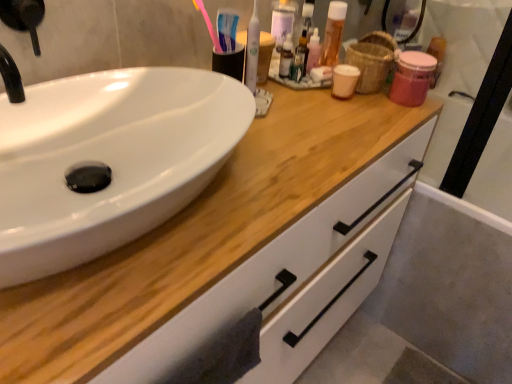
This screenshot has height=384, width=512. What are the coordinates of `vacant area that lies to the right of pink plastic toothbrush at upper center` in the screenshot? It's located at pyautogui.click(x=297, y=112).